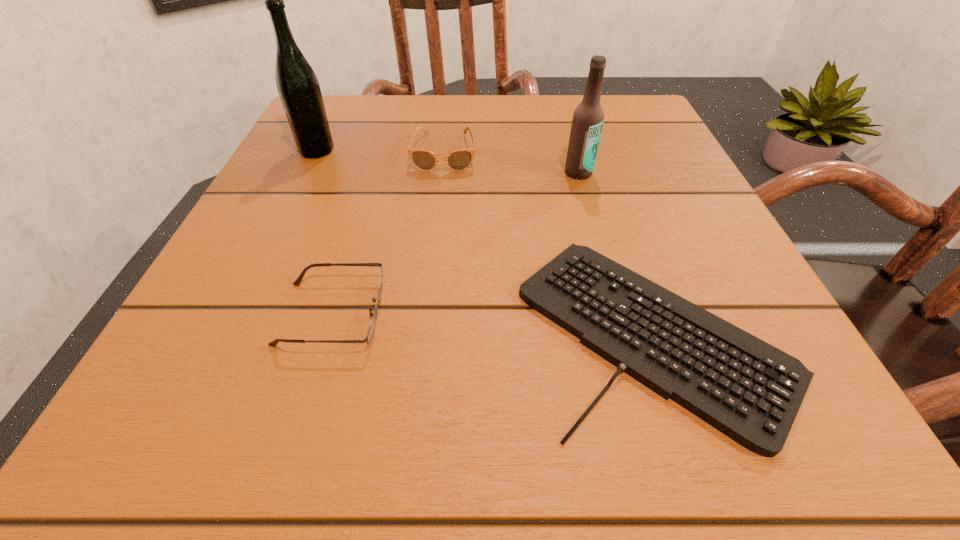
The image size is (960, 540). In order to click on free space that satisfies the following two spatial constraints: 1. on the front-facing side of the sunglasses; 2. on the left side of the computer keyboard in this screenshot , I will do `click(425, 330)`.

Identify the location of vacant region that satisfies the following two spatial constraints: 1. on the side of the right beer bottle with the label; 2. on the front-facing side of the spectacles. (618, 314).